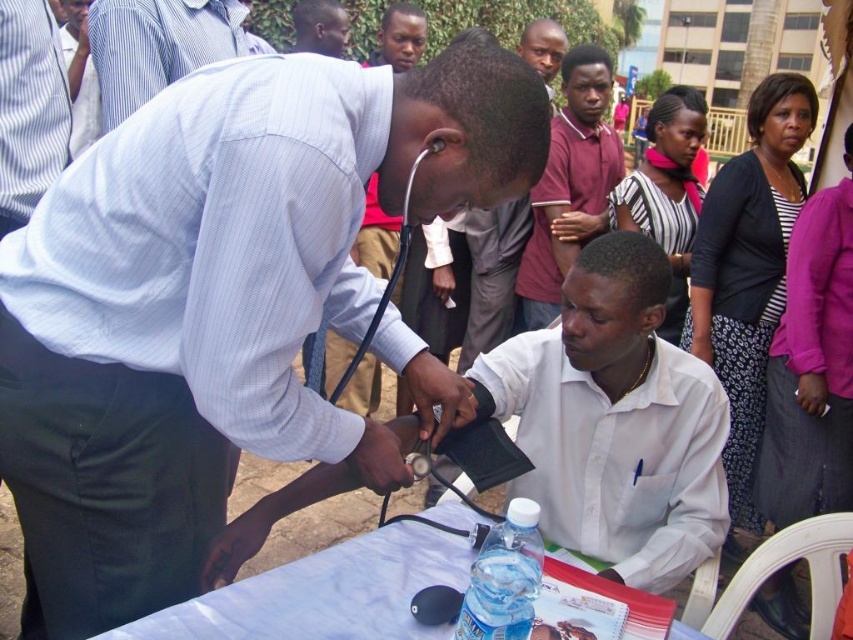
Is white matte shirt at center positioned at the back of translucent plastic water bottle at center?

Yes, it is behind translucent plastic water bottle at center.

Is white matte shirt at center to the left of translucent plastic water bottle at center from the viewer's perspective?

In fact, white matte shirt at center is to the right of translucent plastic water bottle at center.

Describe the element at coordinates (614, 420) in the screenshot. I see `white matte shirt at center` at that location.

The width and height of the screenshot is (853, 640). In order to click on white matte shirt at center in this screenshot , I will do `click(614, 420)`.

Which is more to the left, white cloth table at lower center or matte red shirt at center?

From the viewer's perspective, white cloth table at lower center appears more on the left side.

Who is positioned more to the right, white cloth table at lower center or matte red shirt at center?

From the viewer's perspective, matte red shirt at center appears more on the right side.

Is point (302, 586) positioned behind point (564, 109)?

That is False.

Identify the location of white cloth table at lower center. This screenshot has width=853, height=640. (323, 593).

Locate an element on the screen. matte white shirt at center is located at coordinates (218, 301).

This screenshot has height=640, width=853. In order to click on matte white shirt at center in this screenshot , I will do `click(218, 301)`.